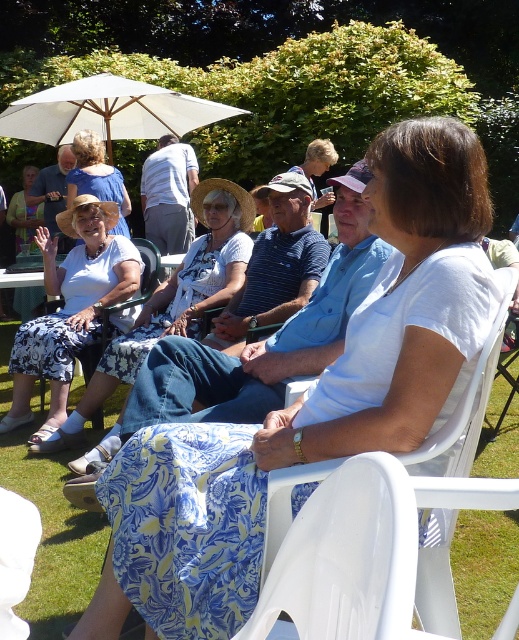
You are a photographer taking a picture of the group. You notice the white floral skirt at center and the white printed fabric skirt at left. Which skirt is positioned lower in the image?

The white floral skirt at center is positioned lower in the image as it is located below the white printed fabric skirt at left.

You are organizing a picnic and need to know if the white plastic chair at center can accommodate someone wearing the matte white blouse at center. Based on their heights, will the chair be tall enough?

The white plastic chair at center is shorter than the matte white blouse at center, so it may not be tall enough to comfortably accommodate someone wearing the blouse.

You are a photographer trying to capture a photo of both the white fabric dress at center and the white floral skirt at center. Since they are both in the center, which one should you focus on first to ensure both are in frame?

The white fabric dress at center is to the right of the white floral skirt at center, so focus on the white floral skirt at center first to ensure both are in frame by positioning the skirt on the left side of your camera viewfinder.